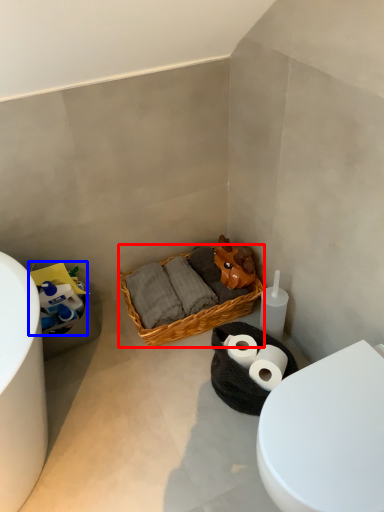
Question: Which of the following is the closest to the observer, picnic basket (highlighted by a red box) or toilet paper (highlighted by a blue box)?

Choices:
 (A) picnic basket
 (B) toilet paper

Answer: (B)